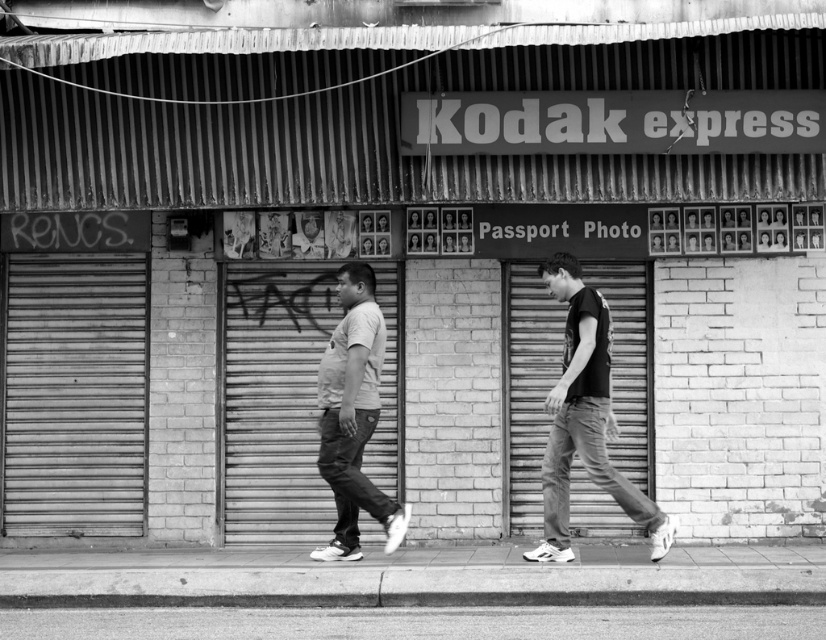
Which is below, black cotton t-shirt at center or smooth concrete curb at lower center?

Positioned lower is smooth concrete curb at lower center.

Who is higher up, black cotton t-shirt at center or smooth concrete curb at lower center?

Positioned higher is black cotton t-shirt at center.

Looking at this image, who is more distant from viewer, [559,284] or [720,602]?

The point [559,284] is behind.

Where is `black cotton t-shirt at center`? The height and width of the screenshot is (640, 826). black cotton t-shirt at center is located at coordinates (585, 419).

Between smooth concrete pavement at lower center and smooth concrete curb at lower center, which one appears on the right side from the viewer's perspective?

smooth concrete pavement at lower center is more to the right.

Is smooth concrete pavement at lower center to the right of smooth concrete curb at lower center from the viewer's perspective?

Indeed, smooth concrete pavement at lower center is positioned on the right side of smooth concrete curb at lower center.

The width and height of the screenshot is (826, 640). Find the location of `smooth concrete pavement at lower center`. smooth concrete pavement at lower center is located at coordinates (418, 621).

Where is `smooth concrete pavement at lower center`? The image size is (826, 640). smooth concrete pavement at lower center is located at coordinates (418, 621).

I want to click on smooth concrete pavement at lower center, so click(x=418, y=621).